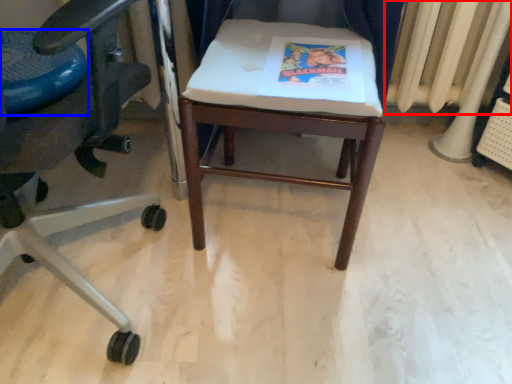
Question: Which point is further to the camera, radiator (highlighted by a red box) or round table (highlighted by a blue box)?

Choices:
 (A) radiator
 (B) round table

Answer: (A)